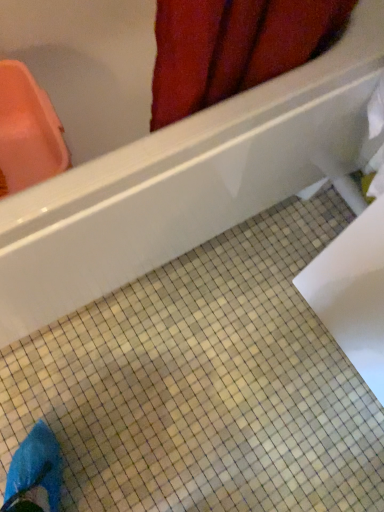
Question: Is white glossy bathtub at upper center bigger or smaller than white glossy ceramic tile at center?

Choices:
 (A) small
 (B) big

Answer: (B)

Question: Is white glossy bathtub at upper center wider or thinner than white glossy ceramic tile at center?

Choices:
 (A) thin
 (B) wide

Answer: (A)

Question: From the image's perspective, is white glossy bathtub at upper center positioned above or below white glossy ceramic tile at center?

Choices:
 (A) below
 (B) above

Answer: (B)

Question: Is white glossy ceramic tile at center bigger or smaller than white glossy bathtub at upper center?

Choices:
 (A) small
 (B) big

Answer: (A)

Question: Choose the correct answer: Is white glossy ceramic tile at center inside white glossy bathtub at upper center or outside it?

Choices:
 (A) outside
 (B) inside

Answer: (A)

Question: Does point click(x=49, y=409) appear closer or farther from the camera than point click(x=117, y=193)?

Choices:
 (A) closer
 (B) farther

Answer: (B)

Question: From the image's perspective, relative to white glossy bathtub at upper center, is white glossy ceramic tile at center above or below?

Choices:
 (A) below
 (B) above

Answer: (A)